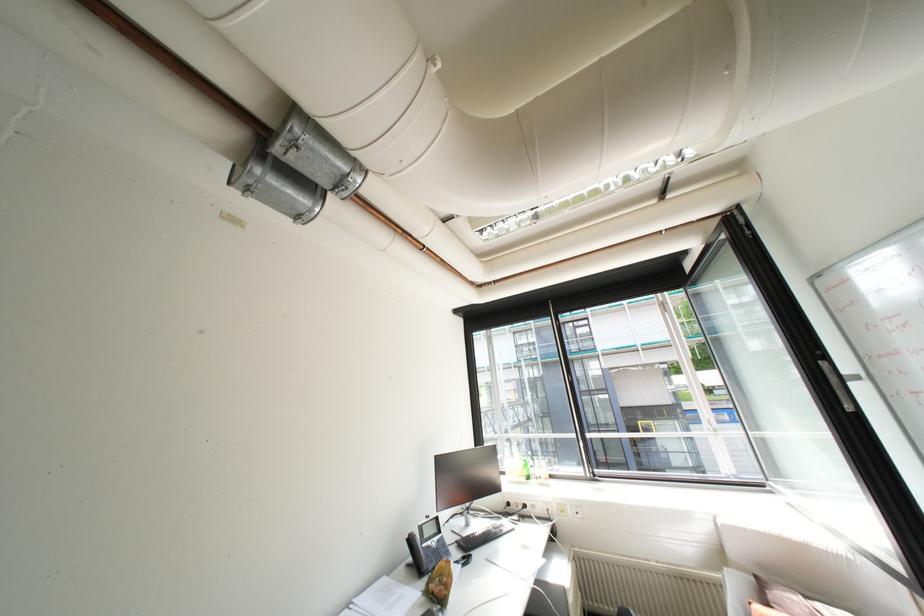
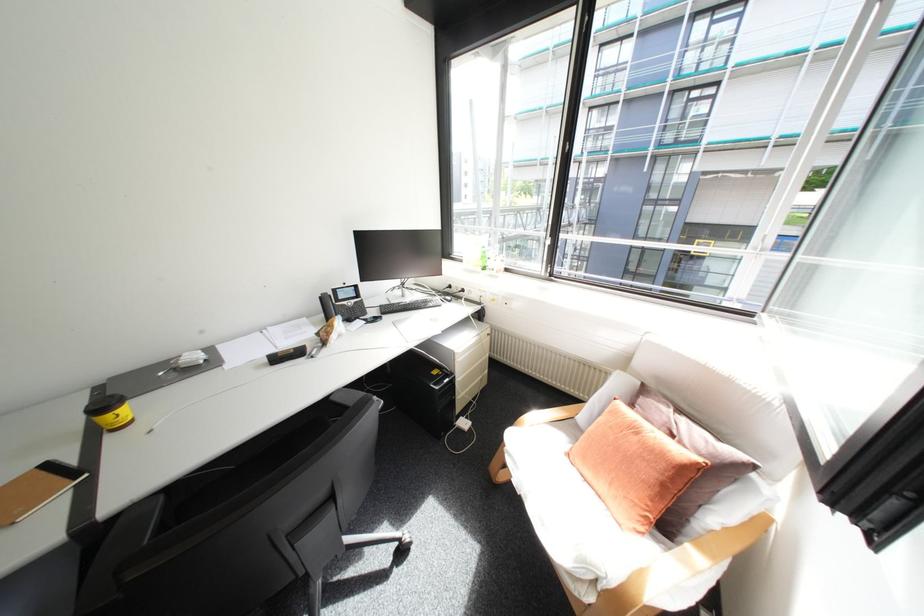
Where in the second image is the point corresponding to [476,537] from the first image?

(403, 304)